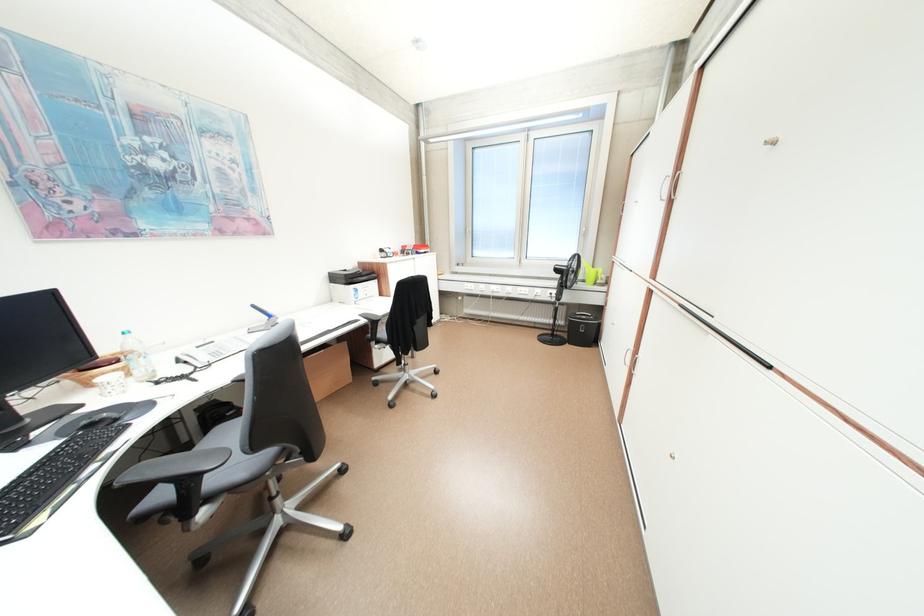
Where is `plastic water bottle`? This screenshot has height=616, width=924. plastic water bottle is located at coordinates (137, 358).